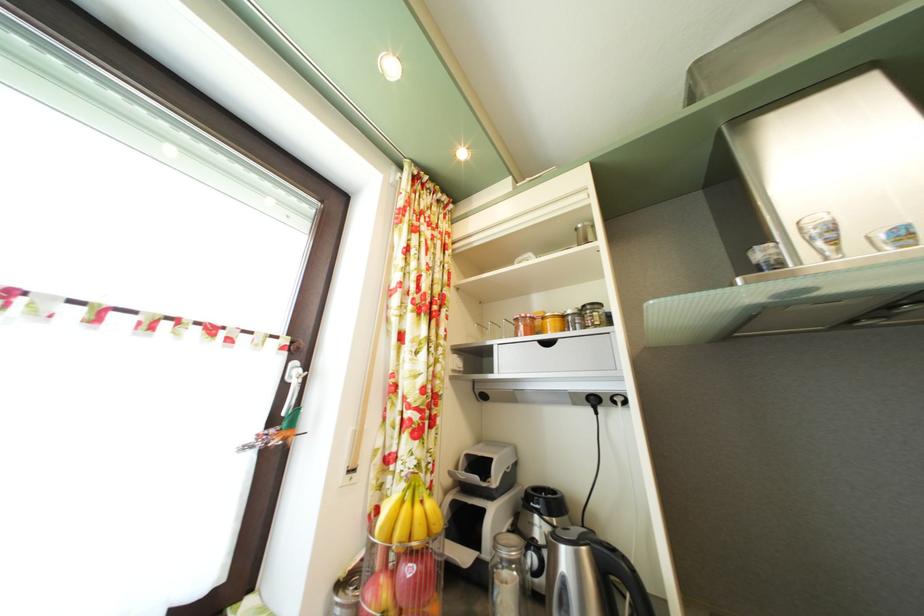
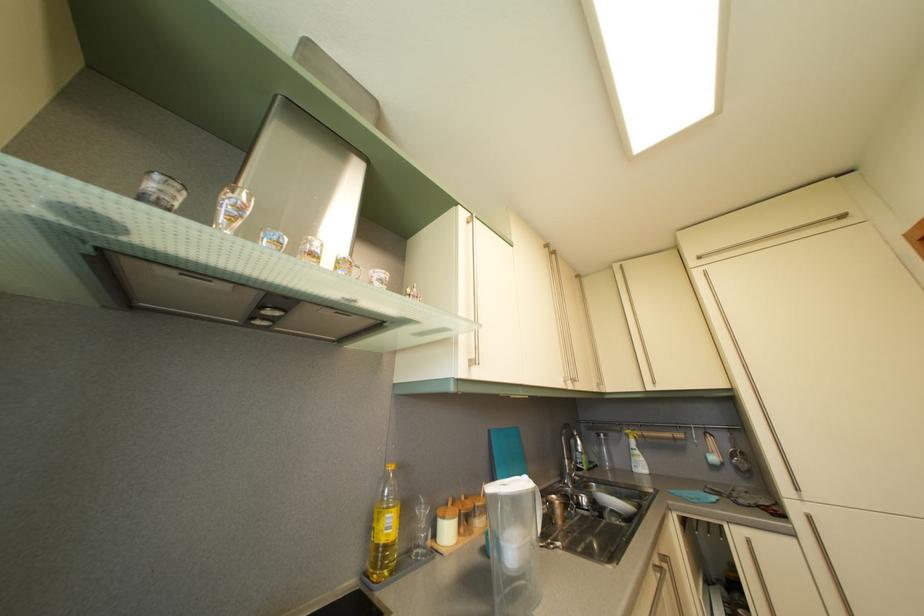
The first image is from the beginning of the video and the second image is from the end. How did the camera likely rotate when shooting the video?

The rotation direction of the camera is right-up.